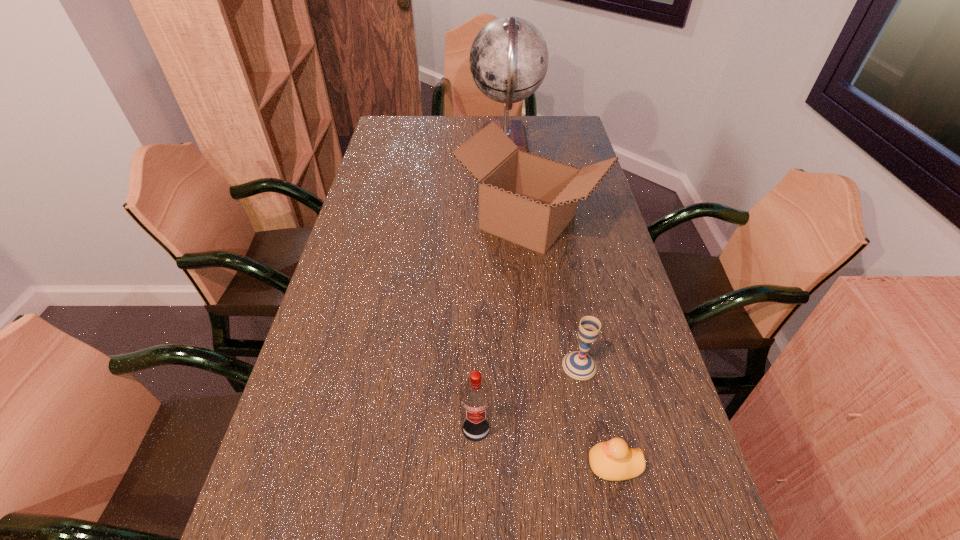
The height and width of the screenshot is (540, 960). I want to click on the farthest object, so click(x=508, y=60).

Image resolution: width=960 pixels, height=540 pixels. Identify the location of the tallest object. (508, 60).

I want to click on box, so click(x=529, y=200).

Identify the location of the second farthest object. The width and height of the screenshot is (960, 540). (529, 200).

Where is `vodka`? vodka is located at coordinates (475, 394).

The image size is (960, 540). What are the coordinates of `the third tallest object` in the screenshot? It's located at (475, 394).

At what (x,y) coordinates should I click in order to perform the action: click on the third nearest object. Please return your answer as a coordinate pair (x, y). Looking at the image, I should click on (579, 365).

The width and height of the screenshot is (960, 540). Find the location of `chalice`. chalice is located at coordinates (579, 365).

You are a GUI agent. You are given a task and a screenshot of the screen. Output one action in this format:
    pyautogui.click(x=<x>, y=<y>)
    Task: Click on the shortest object
    
    Given the screenshot: What is the action you would take?
    pyautogui.click(x=613, y=460)

Find the location of `duck`. duck is located at coordinates 613,460.